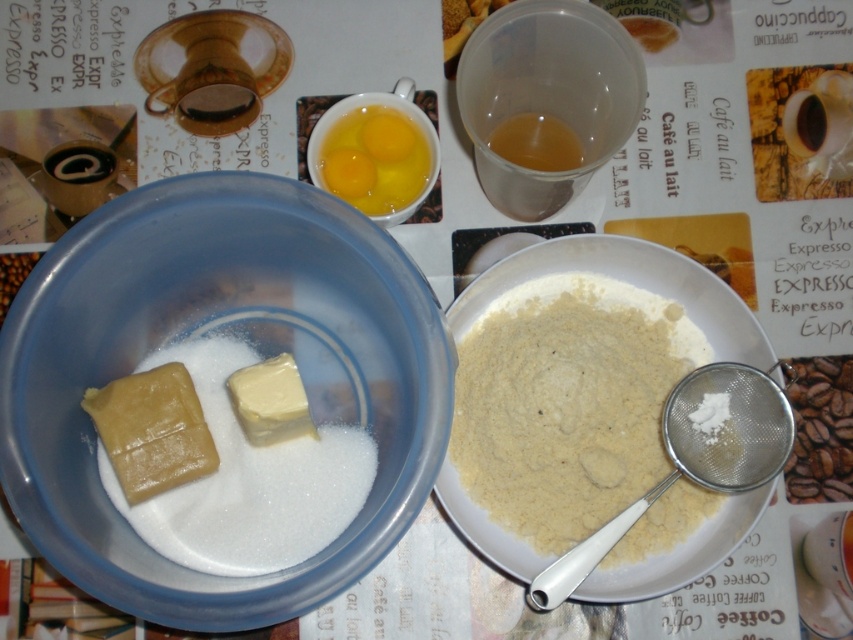
Question: Is white plastic bowl at center closer to camera compared to yellow/yolkish/egg at upper center?

Choices:
 (A) yes
 (B) no

Answer: (A)

Question: Which of the following is the farthest from the observer?

Choices:
 (A) (642, 426)
 (B) (285, 515)
 (C) (366, 113)

Answer: (C)

Question: Estimate the real-world distances between objects in this image. Which object is closer to the white plastic bowl at center?

Choices:
 (A) white powdery flour at center
 (B) yellow/yolkish/egg at upper center

Answer: (A)

Question: Does white plastic bowl at center have a smaller size compared to yellow/yolkish/egg at upper center?

Choices:
 (A) yes
 (B) no

Answer: (B)

Question: Is white plastic bowl at center above white powder at left?

Choices:
 (A) no
 (B) yes

Answer: (B)

Question: Among these objects, which one is farthest from the camera?

Choices:
 (A) white powdery flour at center
 (B) white powder at left

Answer: (A)